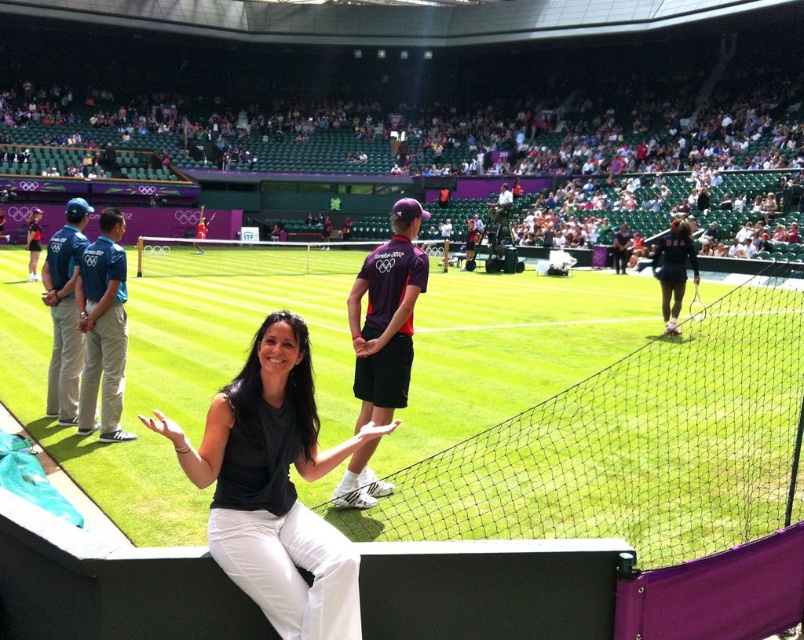
Question: Can you confirm if purple fabric shirt at center is positioned above dark blue uniform at center?

Choices:
 (A) no
 (B) yes

Answer: (A)

Question: Which point appears closest to the camera in this image?

Choices:
 (A) (109, 368)
 (B) (54, 252)
 (C) (665, 246)
 (D) (403, 253)

Answer: (D)

Question: Based on their relative distances, which object is nearer to the black matte shirt at center?

Choices:
 (A) khaki cotton pants at left
 (B) purple fabric shirt at center
 (C) blue fabric uniform at left
 (D) dark blue uniform at center

Answer: (B)

Question: Is purple fabric shirt at center above blue fabric uniform at left?

Choices:
 (A) no
 (B) yes

Answer: (A)

Question: Does purple fabric shirt at center lie behind khaki cotton pants at left?

Choices:
 (A) yes
 (B) no

Answer: (B)

Question: Which of these objects is positioned farthest from the blue fabric uniform at left?

Choices:
 (A) dark blue uniform at center
 (B) black matte shirt at center
 (C) purple fabric shirt at center
 (D) khaki cotton pants at left

Answer: (A)